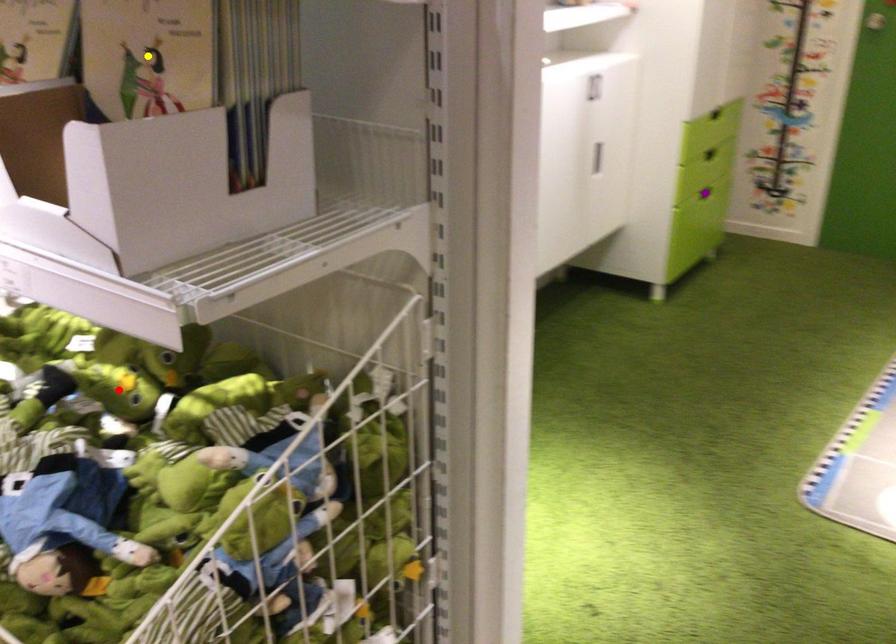
Order these from farthest to nearest:
red point
yellow point
purple point

purple point, red point, yellow point